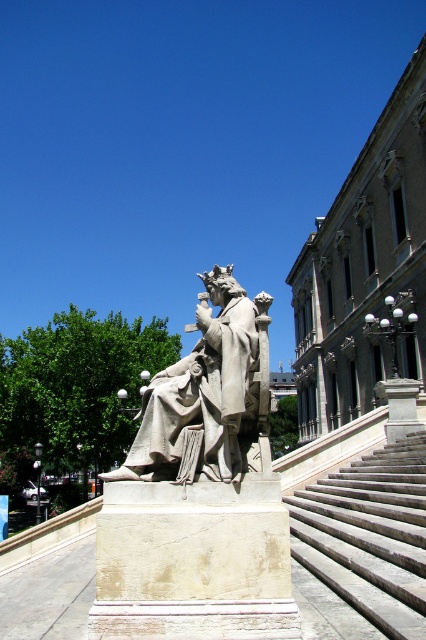
Is stone statue at center positioned in front of gray stone statue at center?

That is True.

Describe the element at coordinates (198, 493) in the screenshot. I see `stone statue at center` at that location.

At what (x,y) coordinates should I click in order to perform the action: click on stone statue at center. Please return your answer as a coordinate pair (x, y). Looking at the image, I should click on (198, 493).

Is stone stairs at center taller than gray stone statue at center?

In fact, stone stairs at center may be shorter than gray stone statue at center.

Can you confirm if stone stairs at center is positioned below gray stone statue at center?

No, stone stairs at center is not below gray stone statue at center.

Where is `stone stairs at center`? stone stairs at center is located at coordinates (362, 547).

The height and width of the screenshot is (640, 426). In order to click on stone stairs at center in this screenshot , I will do `click(362, 547)`.

Between point (195, 563) and point (290, 545), which one is positioned behind?

Positioned behind is point (290, 545).

Does stone statue at center appear over stone stairs at center?

Yes.

Where is `stone statue at center`? stone statue at center is located at coordinates [198, 493].